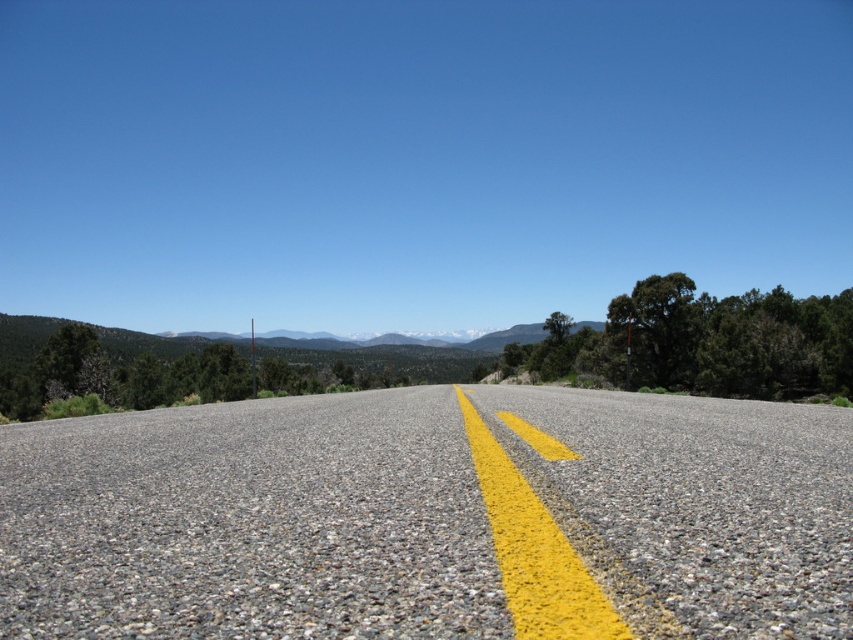
Based on the photo, who is more distant from viewer, (720, 417) or (602, 616)?

The point (720, 417) is more distant.

Where is `gray gravel at center`? This screenshot has height=640, width=853. gray gravel at center is located at coordinates (248, 522).

This screenshot has width=853, height=640. Identify the location of gray gravel at center. (248, 522).